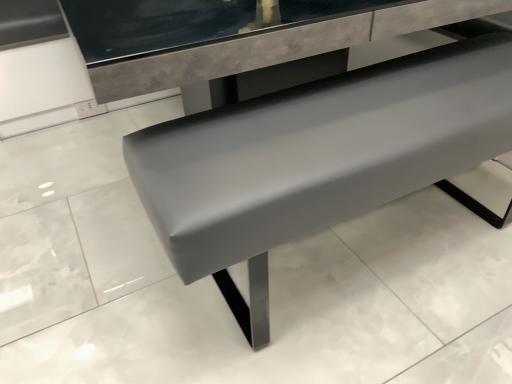
This screenshot has height=384, width=512. What do you see at coordinates (317, 158) in the screenshot?
I see `matte gray bench at center` at bounding box center [317, 158].

Locate an element on the screen. Image resolution: width=512 pixels, height=384 pixels. matte gray bench at center is located at coordinates (317, 158).

The image size is (512, 384). What are the coordinates of `matte gray bench at center` in the screenshot? It's located at (317, 158).